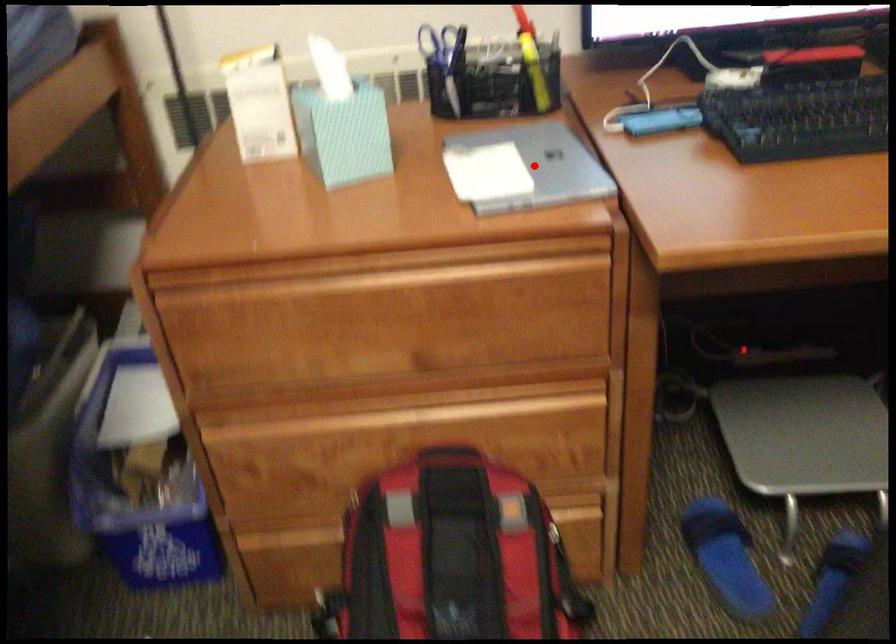
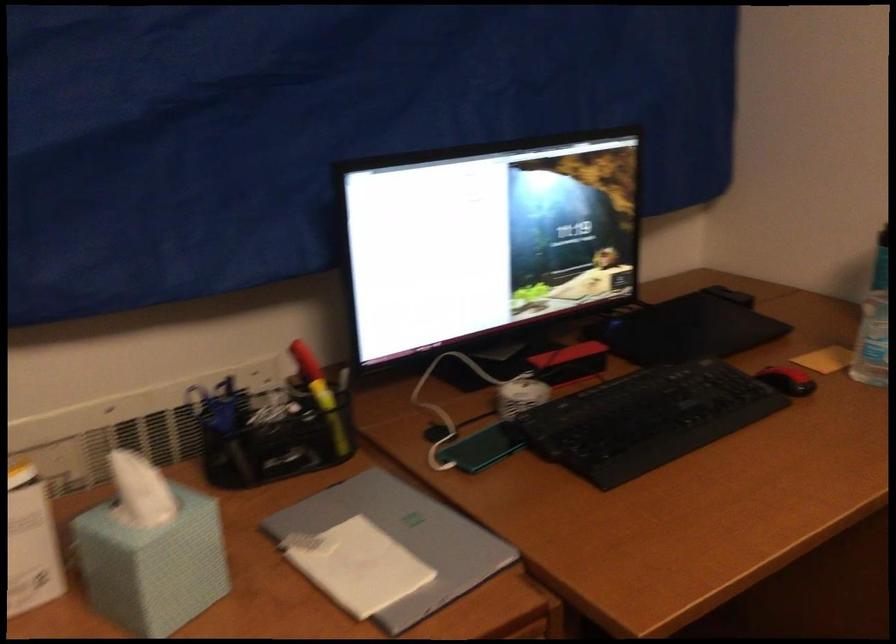
Find the pixel in the second image that matches the highlighted location in the first image.

(403, 538)